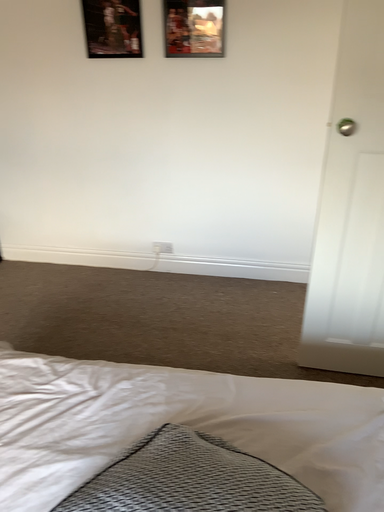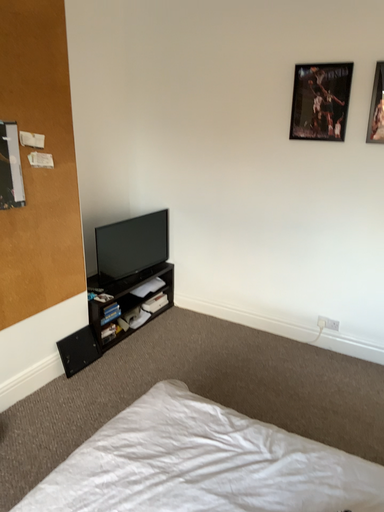
Question: Which way did the camera rotate in the video?

Choices:
 (A) rotated upward
 (B) rotated downward

Answer: (A)